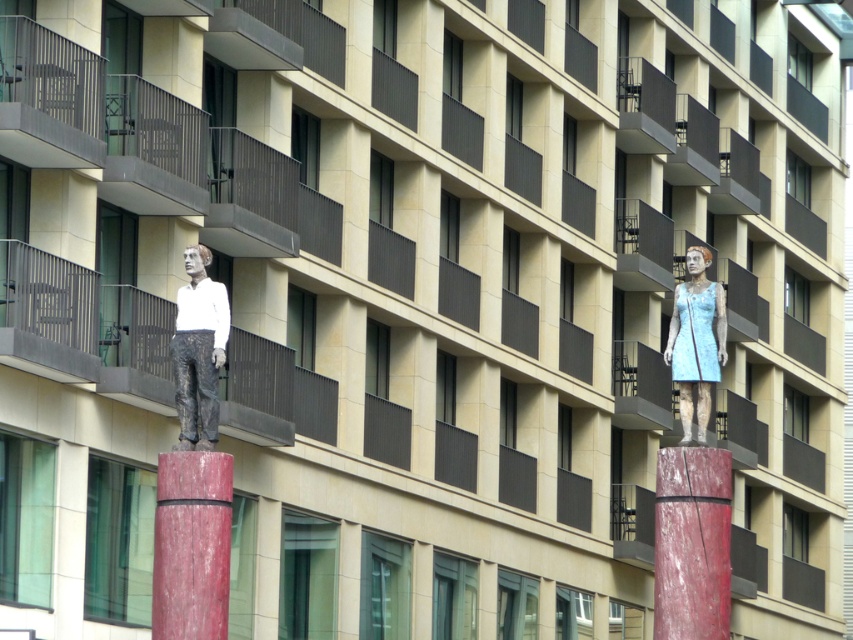
Can you confirm if smooth red wood at center is positioned below matte white statue at center?

Correct, smooth red wood at center is located below matte white statue at center.

In the scene shown: Who is positioned more to the right, smooth red wood at center or matte white statue at center?

smooth red wood at center is more to the right.

Locate an element on the screen. smooth red wood at center is located at coordinates (692, 544).

Does point (723, 467) come behind point (675, 301)?

That is False.

Can you confirm if smooth red wood at center is taller than blue fabric dress at right?

Indeed, smooth red wood at center has a greater height compared to blue fabric dress at right.

Locate an element on the screen. This screenshot has width=853, height=640. smooth red wood at center is located at coordinates (692, 544).

The image size is (853, 640). What are the coordinates of `smooth red wood at center` in the screenshot? It's located at 692,544.

Which is below, matte white statue at center or blue fabric dress at right?

matte white statue at center is below.

Does matte white statue at center have a lesser height compared to blue fabric dress at right?

Indeed, matte white statue at center has a lesser height compared to blue fabric dress at right.

Is point (184, 420) positioned behind point (669, 362)?

That is False.

Find the location of a particular element. This screenshot has height=640, width=853. matte white statue at center is located at coordinates (198, 352).